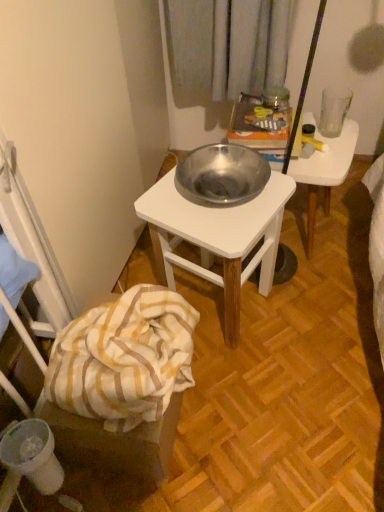
At what (x,y) coordinates should I click in order to perform the action: click on vacant space in front of metallic white table at center. Please return your answer as a coordinate pair (x, y). The image size is (384, 512). Looking at the image, I should click on (254, 389).